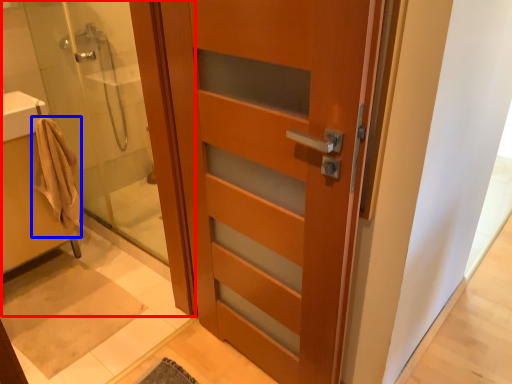
Question: Among these objects, which one is nearest to the camera, shower door (highlighted by a red box) or bathrobe (highlighted by a blue box)?

Choices:
 (A) shower door
 (B) bathrobe

Answer: (A)